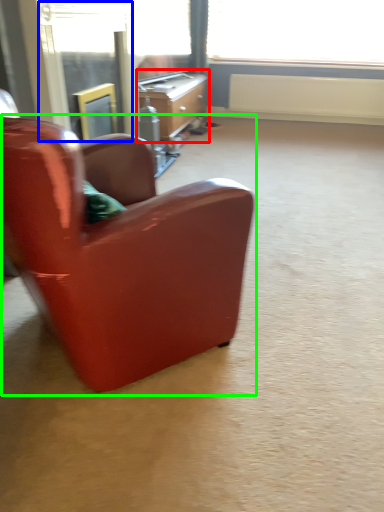
Question: Which is nearer to the desk (highlighted by a red box)? screen door (highlighted by a blue box) or chair (highlighted by a green box).

Choices:
 (A) screen door
 (B) chair

Answer: (A)